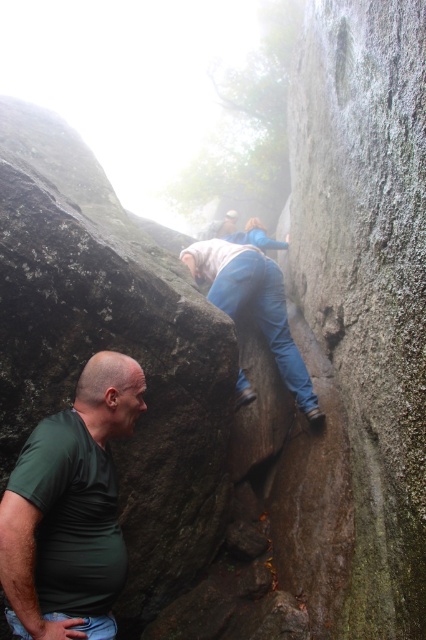
From the picture: You are a hiker trying to navigate through the rocks. You see the green matte shirt at lower left and the blue jeans at center. Which one is closer to you?

The green matte shirt at lower left is closer to you because it is in front of the blue jeans at center.

You are a safety inspector assessing the climbing site. The safety guidelines state that climbers must maintain at least 2 meters of distance between each other for safety. Based on the image, is the distance between the green matte shirt at lower left and the blue jeans at center compliant with the safety guidelines?

The distance between the green matte shirt at lower left and the blue jeans at center is 2.38 meters, which exceeds the required 2 meters, so it is compliant with the safety guidelines.

You are a hiker who wants to place a marker at the exact center of the rock formation. Given the coordinates of the green matte shirt at lower left, can you determine if the marker should be placed to the left or right of the shirt?

The green matte shirt at lower left is located at coordinate point 0.792 on the x axis. Since the center of the rock formation would be at 0.5, the marker should be placed to the left of the green matte shirt at lower left.